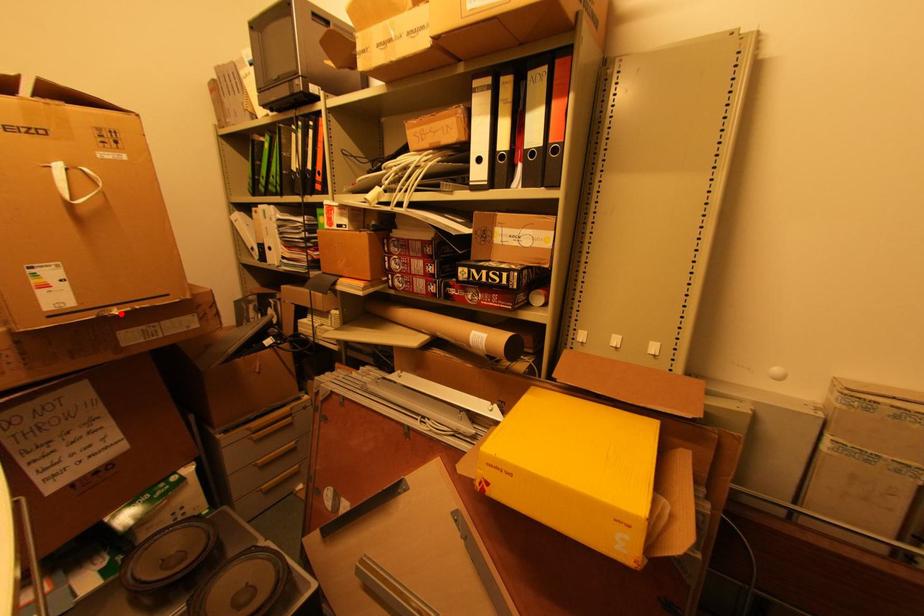
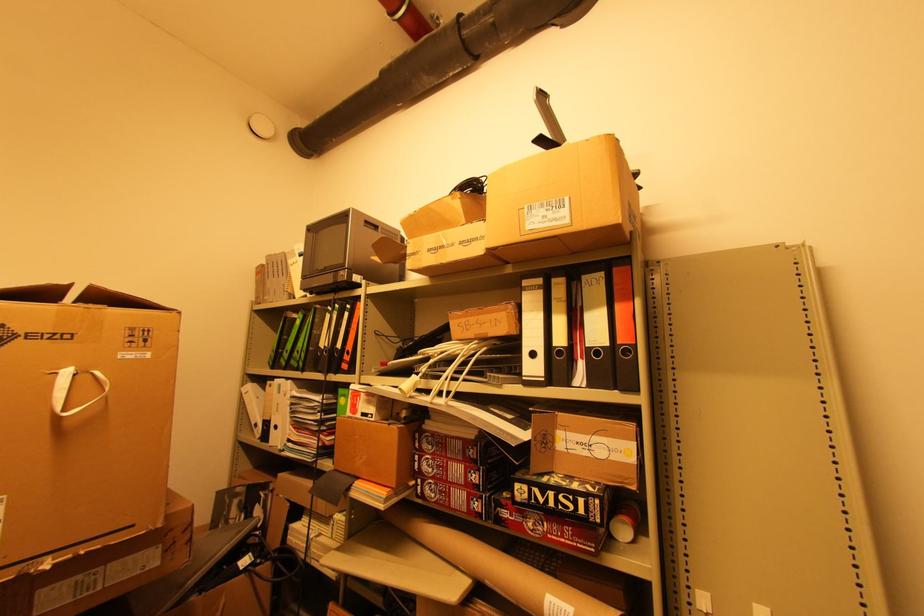
Question: A red point is marked in image1. In image2, is the corresponding 3D point closer to the camera or farther? Reply with the corresponding letter.

Choices:
 (A) The corresponding 3D point is closer.
 (B) The corresponding 3D point is farther.

Answer: (A)